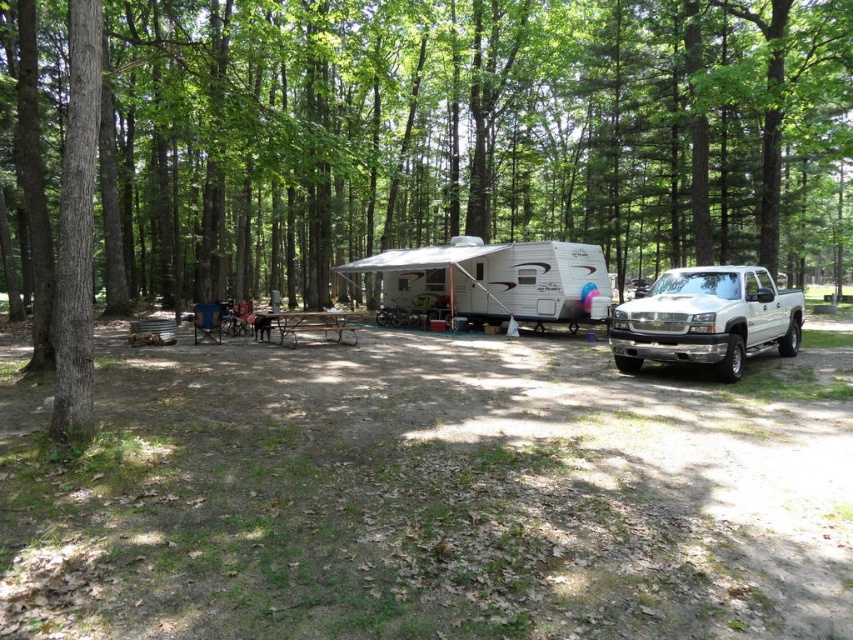
Can you confirm if brown textured tree at center is thinner than brown metal picnic table at center?

No, brown textured tree at center is not thinner than brown metal picnic table at center.

Does brown textured tree at center appear over brown metal picnic table at center?

Indeed, brown textured tree at center is positioned over brown metal picnic table at center.

In order to click on brown textured tree at center in this screenshot , I will do pyautogui.click(x=466, y=134).

Between brown textured tree at center and white glossy pickup truck at right, which one has less height?

Standing shorter between the two is white glossy pickup truck at right.

Does brown textured tree at center have a larger size compared to white glossy pickup truck at right?

Correct, brown textured tree at center is larger in size than white glossy pickup truck at right.

Is point (553, 108) positioned in front of point (672, 308)?

That is False.

Locate an element on the screen. This screenshot has width=853, height=640. brown textured tree at center is located at coordinates (466, 134).

Between point (666, 317) and point (325, 324), which one is positioned behind?

Positioned behind is point (325, 324).

Based on the photo, which is below, white glossy pickup truck at right or brown metal picnic table at center?

white glossy pickup truck at right is below.

Does point (715, 355) come in front of point (332, 320)?

Yes, point (715, 355) is closer to viewer.

You are a GUI agent. You are given a task and a screenshot of the screen. Output one action in this format:
    pyautogui.click(x=<x>, y=<y>)
    Task: Click on the white glossy pickup truck at right
    Image resolution: width=853 pixels, height=640 pixels.
    Given the screenshot: What is the action you would take?
    pyautogui.click(x=706, y=320)